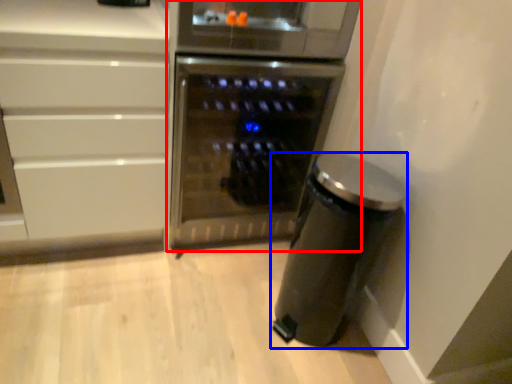
Question: Which point is further to the camera, home appliance (highlighted by a red box) or kitchen appliance (highlighted by a blue box)?

Choices:
 (A) home appliance
 (B) kitchen appliance

Answer: (A)